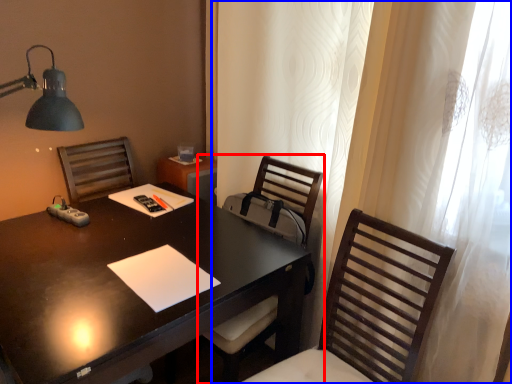
Question: Which object appears farthest to the camera in this image, chair (highlighted by a red box) or curtain (highlighted by a blue box)?

Choices:
 (A) chair
 (B) curtain

Answer: (A)